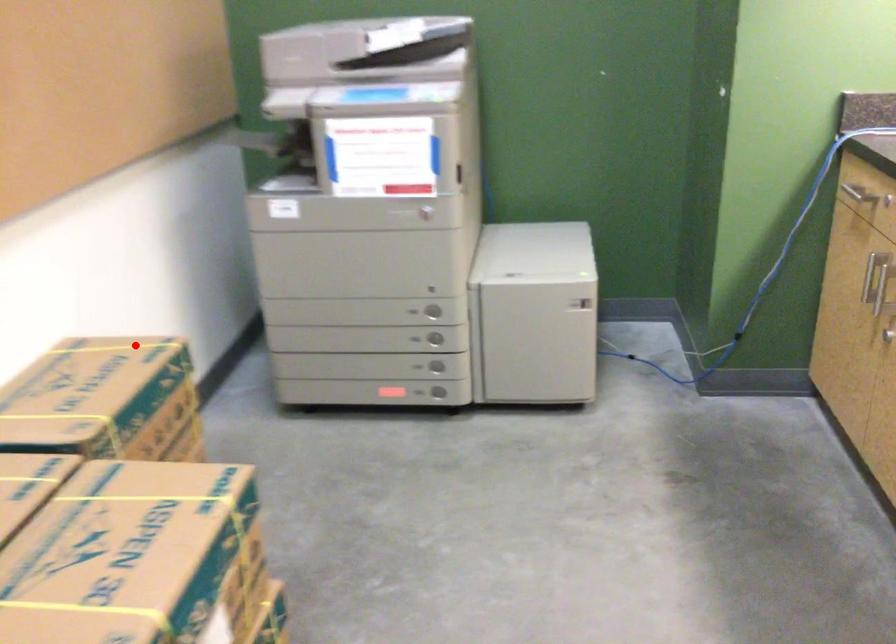
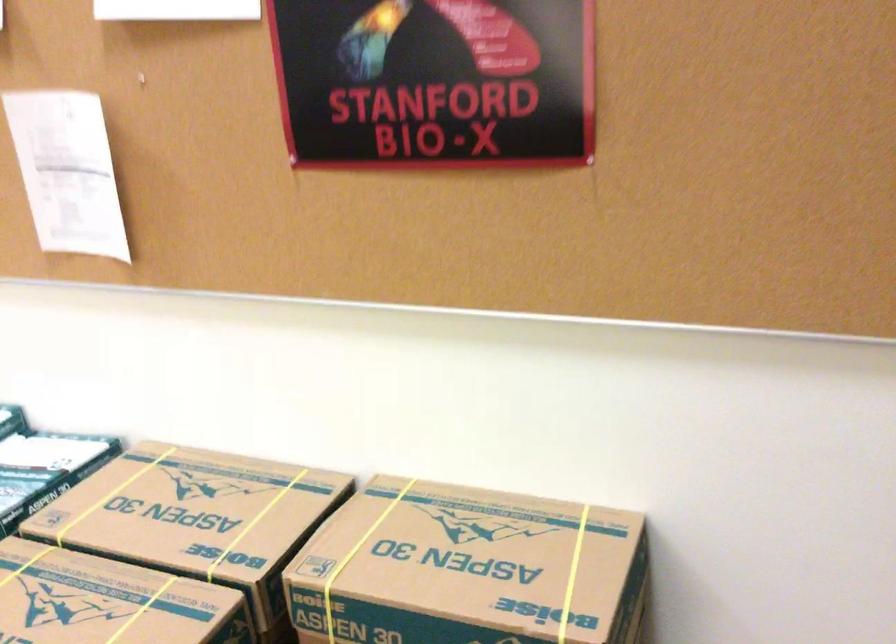
Where in the second image is the point corresponding to the highlighted location from the first image?

(572, 574)